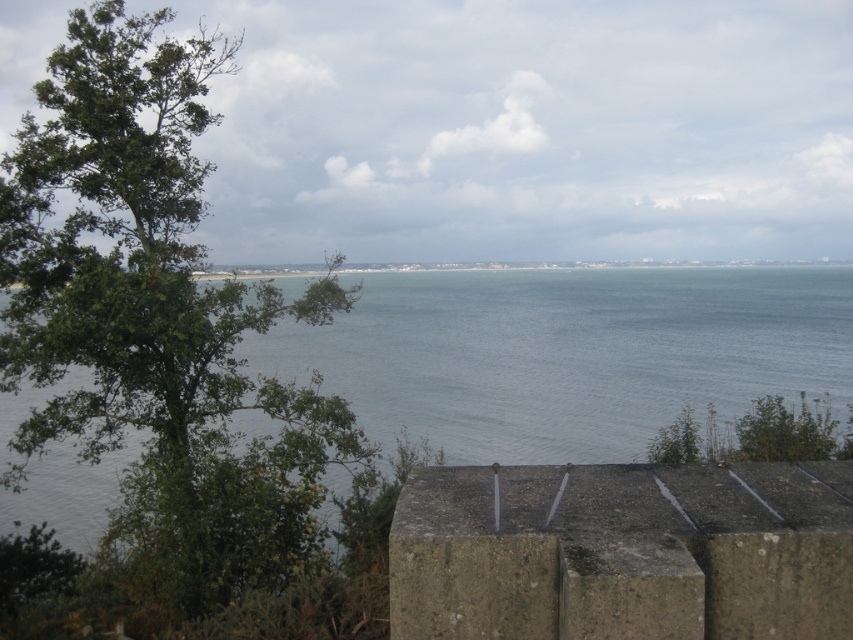
The height and width of the screenshot is (640, 853). What do you see at coordinates (157, 320) in the screenshot? I see `green leafy tree at left` at bounding box center [157, 320].

Can you confirm if green leafy tree at left is thinner than blue water at center?

Indeed, green leafy tree at left has a lesser width compared to blue water at center.

Is point (16, 252) less distant than point (328, 330)?

Yes.

Image resolution: width=853 pixels, height=640 pixels. Find the location of `green leafy tree at left`. green leafy tree at left is located at coordinates (157, 320).

Is green leafy tree at left thinner than concrete ledge at lower center?

No, green leafy tree at left is not thinner than concrete ledge at lower center.

Can you confirm if green leafy tree at left is wider than concrete ledge at lower center?

Correct, the width of green leafy tree at left exceeds that of concrete ledge at lower center.

You are a GUI agent. You are given a task and a screenshot of the screen. Output one action in this format:
    pyautogui.click(x=<x>, y=<y>)
    Task: Click on the green leafy tree at left
    
    Given the screenshot: What is the action you would take?
    click(x=157, y=320)

Measure the distance from blue water at center to concrete ledge at lower center.

14.64 meters

Is blue water at center thinner than concrete ledge at lower center?

No, blue water at center is not thinner than concrete ledge at lower center.

Does point (444, 397) come in front of point (466, 496)?

No, it is not.

Identify the location of blue water at center. Image resolution: width=853 pixels, height=640 pixels. (567, 353).